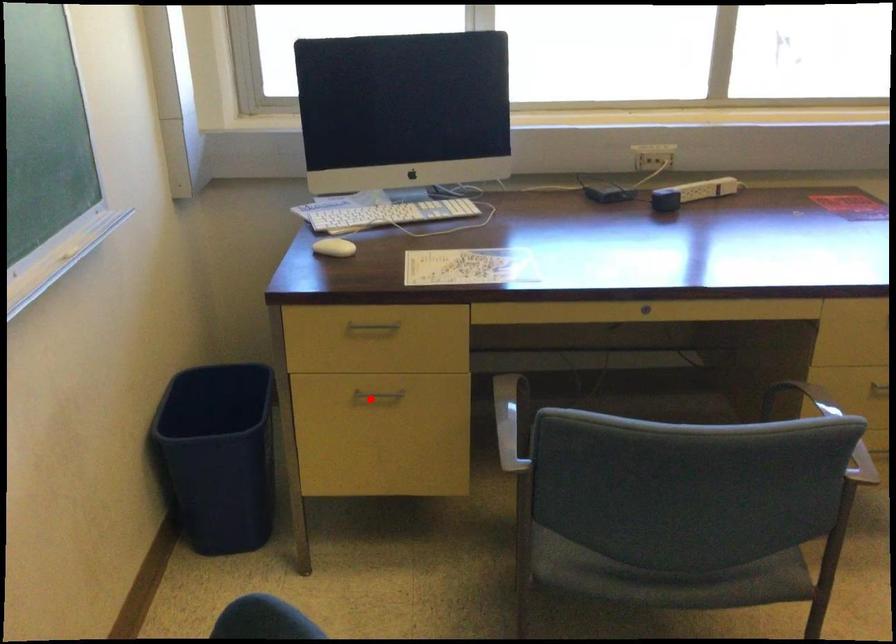
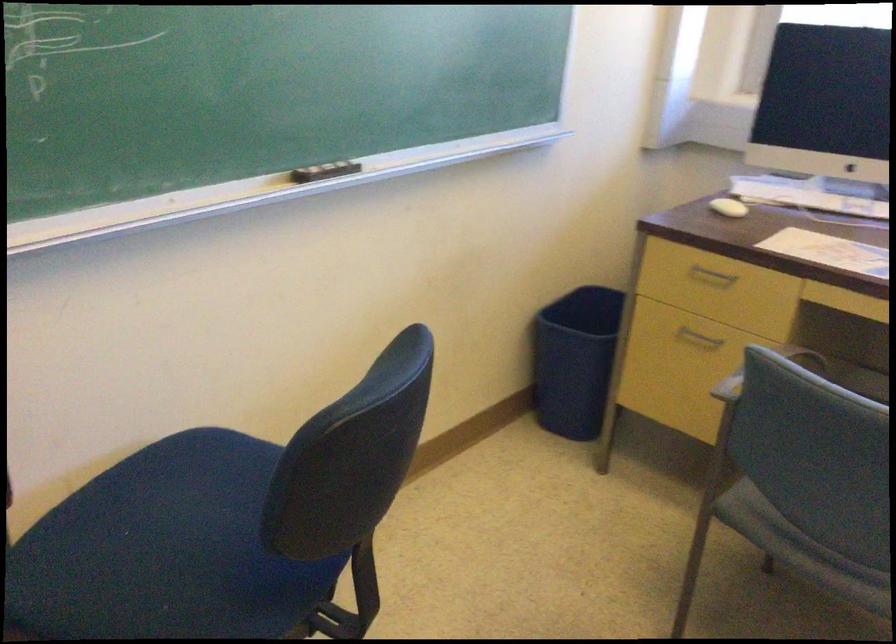
Question: I am providing you with two images of the same scene from different viewpoints. Given a red point in image1, look at the same physical point in image2. Is it:

Choices:
 (A) Closer to the viewpoint
 (B) Farther from the viewpoint

Answer: (B)